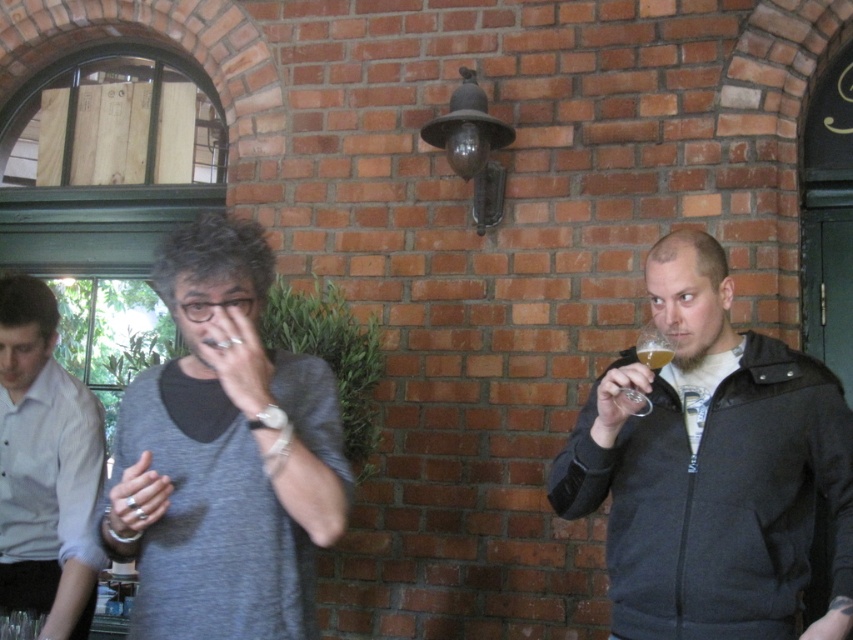
Who is more distant from viewer, (675,481) or (229,481)?

Point (675,481)

Which is more to the right, dark gray zip-up jacket at right or gray matte shirt at center?

dark gray zip-up jacket at right

Between point (790, 616) and point (178, 582), which one is positioned in front?

Point (178, 582) is in front.

Locate an element on the screen. dark gray zip-up jacket at right is located at coordinates (711, 468).

Find the location of a particular element. This screenshot has width=853, height=640. gray matte shirt at center is located at coordinates (224, 454).

Who is taller, gray matte shirt at center or translucent glass at right?

With more height is gray matte shirt at center.

Can you confirm if gray matte shirt at center is taller than translucent glass at right?

Correct, gray matte shirt at center is much taller as translucent glass at right.

Which is behind, point (195, 472) or point (639, 356)?

The point (639, 356) is behind.

Identify the location of gray matte shirt at center. This screenshot has height=640, width=853. (224, 454).